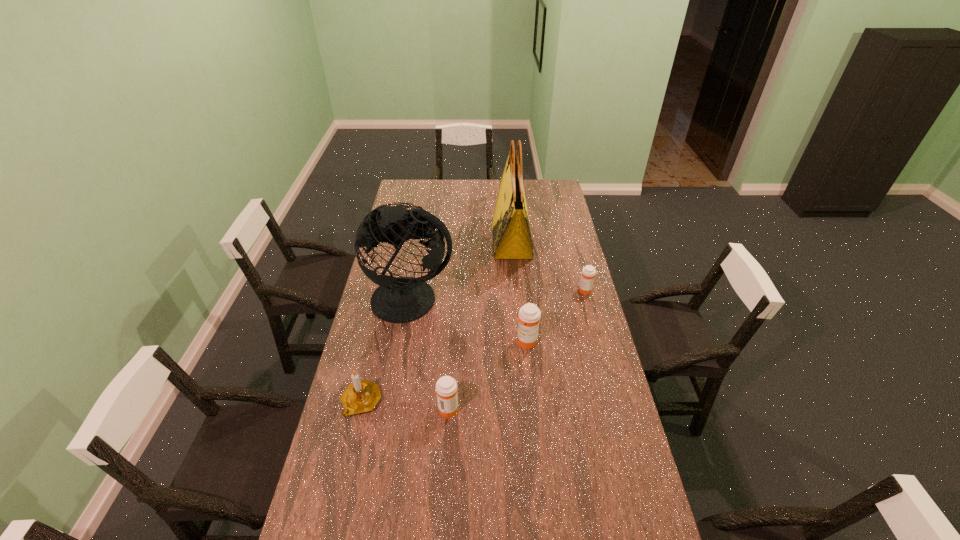
Where is `vacant point located between the globe and the candle holder`? This screenshot has height=540, width=960. vacant point located between the globe and the candle holder is located at coordinates (386, 351).

Where is `vacant area that lies between the tote bag and the leftmost medicine`? This screenshot has width=960, height=540. vacant area that lies between the tote bag and the leftmost medicine is located at coordinates (480, 325).

This screenshot has width=960, height=540. In order to click on vacant region between the tote bag and the leftmost medicine in this screenshot , I will do `click(480, 325)`.

Locate an element on the screen. The width and height of the screenshot is (960, 540). free space that is in between the candle holder and the farthest medicine is located at coordinates (473, 346).

Point out which object is positioned as the nearest to the second farthest medicine. Please provide its 2D coordinates. Your answer should be formatted as a tuple, i.e. [(x, y)], where the tuple contains the x and y coordinates of a point satisfying the conditions above.

[(404, 299)]

Image resolution: width=960 pixels, height=540 pixels. I want to click on object identified as the fifth closest to the tote bag, so click(361, 396).

Select which medicine appears as the third closest to the globe. Please provide its 2D coordinates. Your answer should be formatted as a tuple, i.e. [(x, y)], where the tuple contains the x and y coordinates of a point satisfying the conditions above.

[(588, 272)]

You are a GUI agent. You are given a task and a screenshot of the screen. Output one action in this format:
    pyautogui.click(x=<x>, y=<y>)
    Task: Click on the medicine identified as the second closest to the globe
    The width and height of the screenshot is (960, 540).
    Given the screenshot: What is the action you would take?
    pyautogui.click(x=446, y=387)

Where is `vacant space that satisfies the following two spatial constraints: 1. on the front-facing side of the tote bag; 2. on the front-facing side of the globe`? Image resolution: width=960 pixels, height=540 pixels. vacant space that satisfies the following two spatial constraints: 1. on the front-facing side of the tote bag; 2. on the front-facing side of the globe is located at coordinates (517, 300).

The image size is (960, 540). What are the coordinates of `vacant space that satisfies the following two spatial constraints: 1. on the front-facing side of the tote bag; 2. on the front-facing side of the globe` in the screenshot? It's located at (517, 300).